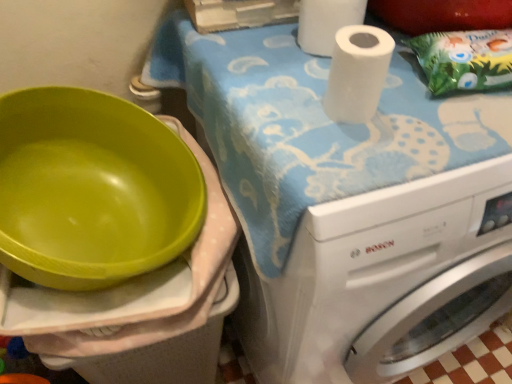
Question: Is point (504, 79) positioned closer to the camera than point (377, 291)?

Choices:
 (A) farther
 (B) closer

Answer: (B)

Question: From their relative heights in the image, would you say green paper bag at upper right is taller or shorter than white glossy washing machine at upper right?

Choices:
 (A) short
 (B) tall

Answer: (A)

Question: Estimate the real-world distances between objects in this image. Which object is closer to the white glossy washing machine at upper right?

Choices:
 (A) green paper bag at upper right
 (B) white matte paper towel at upper center, placed as the 1th paper towel when sorted from front to back
 (C) white matte paper towel at upper right, which appears as the 1th paper towel when viewed from the back

Answer: (B)

Question: Estimate the real-world distances between objects in this image. Which object is farther from the white matte paper towel at upper right, the 2th paper towel positioned from the front?

Choices:
 (A) white matte paper towel at upper center, the 2th paper towel in the back-to-front sequence
 (B) green paper bag at upper right
 (C) white glossy washing machine at upper right

Answer: (C)